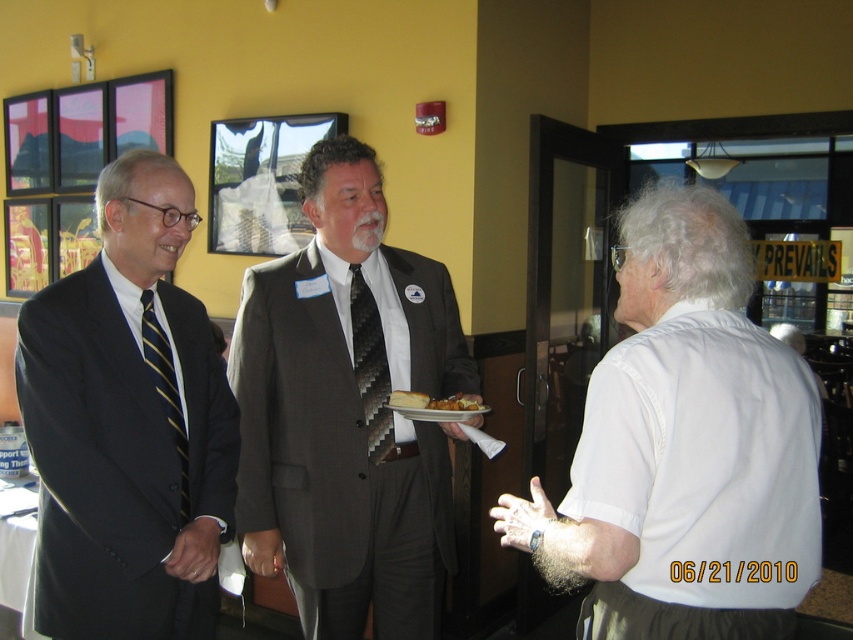
Question: Which of the following is the farthest from the observer?

Choices:
 (A) (395, 576)
 (B) (93, 387)
 (C) (389, 433)

Answer: (A)

Question: Which of the following is the closest to the observer?

Choices:
 (A) black textured tie at center
 (B) golden brown bread at center
 (C) white cotton shirt at right
 (D) striped silk tie at left

Answer: (C)

Question: Does white cotton shirt at right appear under golden brown bread at center?

Choices:
 (A) no
 (B) yes

Answer: (A)

Question: Which point is farther to the camera?

Choices:
 (A) (395, 403)
 (B) (361, 358)
 (C) (437, 342)

Answer: (C)

Question: Does white cotton shirt at right have a lesser width compared to striped silk tie at left?

Choices:
 (A) no
 (B) yes

Answer: (A)

Question: Does black textured tie at center have a larger size compared to golden brown bread at center?

Choices:
 (A) yes
 (B) no

Answer: (A)